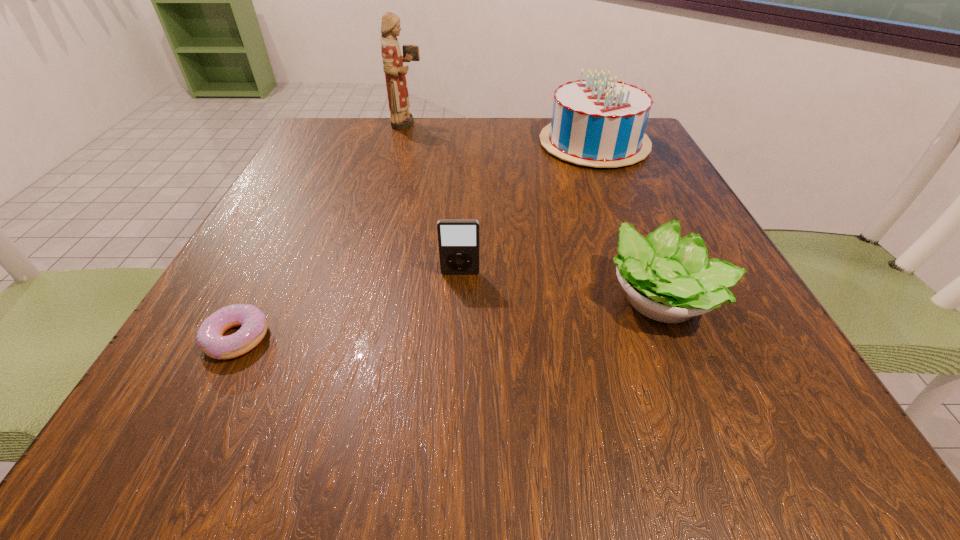
You are a GUI agent. You are given a task and a screenshot of the screen. Output one action in this format:
    pyautogui.click(x=<x>, y=<y>)
    Task: Click on the unoccupied position between the doughnut and the fourth object from right to left
    The height and width of the screenshot is (540, 960).
    Given the screenshot: What is the action you would take?
    pyautogui.click(x=323, y=231)

The height and width of the screenshot is (540, 960). What are the coordinates of `unoccupied area between the doughnut and the birthday cake` in the screenshot? It's located at (416, 241).

In order to click on vacant space that is in between the leftmost object and the fourth shortest object in this screenshot , I will do `click(416, 241)`.

You are a GUI agent. You are given a task and a screenshot of the screen. Output one action in this format:
    pyautogui.click(x=<x>, y=<y>)
    Task: Click on the vacant area that lies between the second tallest object and the figurine
    
    Given the screenshot: What is the action you would take?
    pyautogui.click(x=501, y=133)

You are a GUI agent. You are given a task and a screenshot of the screen. Output one action in this format:
    pyautogui.click(x=<x>, y=<y>)
    Task: Click on the free space that is in between the birthday cake and the lettuce
    The height and width of the screenshot is (540, 960).
    Given the screenshot: What is the action you would take?
    pyautogui.click(x=628, y=221)

Identify which object is located as the second nearest to the leftmost object. Please provide its 2D coordinates. Your answer should be formatted as a tuple, i.e. [(x, y)], where the tuple contains the x and y coordinates of a point satisfying the conditions above.

[(669, 279)]

Locate an element on the screen. The image size is (960, 540). object that stands as the fourth closest to the third object from left to right is located at coordinates (400, 117).

I want to click on free spot that satisfies the following two spatial constraints: 1. on the front-facing side of the lettuce; 2. on the left side of the iPod, so click(x=459, y=299).

The image size is (960, 540). I want to click on free region that satisfies the following two spatial constraints: 1. on the front-facing side of the second tallest object; 2. on the left side of the figurine, so (403, 143).

Image resolution: width=960 pixels, height=540 pixels. I want to click on vacant space that satisfies the following two spatial constraints: 1. on the front-facing side of the second object from left to right; 2. on the back side of the lettuce, so click(x=360, y=299).